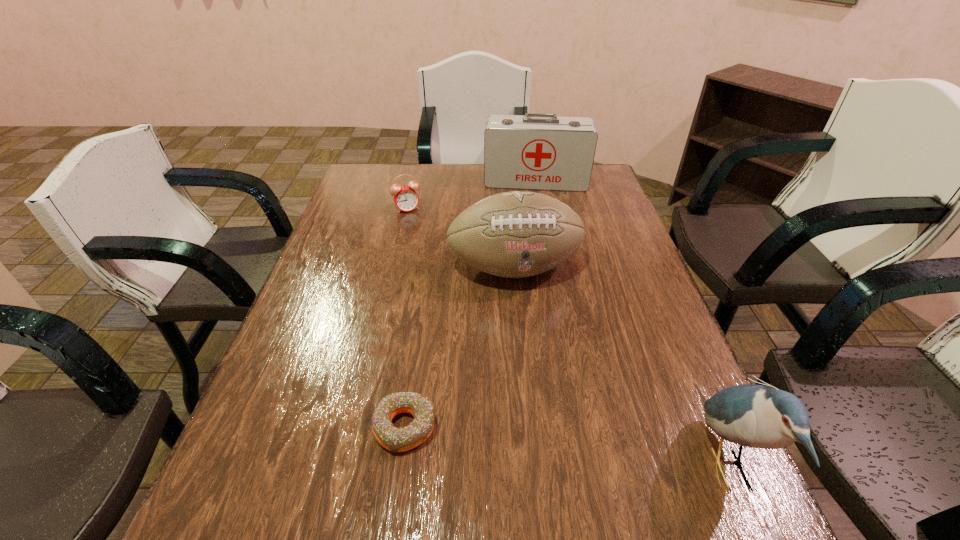
Image resolution: width=960 pixels, height=540 pixels. Find the location of `the first-aid kit that is at the right edge`. the first-aid kit that is at the right edge is located at coordinates (533, 151).

Where is `object that is at the far right corner`? The width and height of the screenshot is (960, 540). object that is at the far right corner is located at coordinates (533, 151).

Find the location of a particular element. object situated at the near right corner is located at coordinates (759, 416).

This screenshot has width=960, height=540. Identify the location of vacant region at the far edge of the desktop. (426, 179).

Find the location of a particular element. The image size is (960, 540). vacant space at the near edge is located at coordinates (423, 445).

Find the location of a particular element. free location at the left edge of the desktop is located at coordinates (296, 309).

The width and height of the screenshot is (960, 540). In the image, there is a desktop. In order to click on vacant area at the right edge in this screenshot , I will do `click(604, 248)`.

Find the location of a particular element. Image resolution: width=960 pixels, height=540 pixels. vacant space at the near left corner is located at coordinates (258, 480).

In the image, there is a desktop. In order to click on vacant region at the far right corner in this screenshot , I will do `click(595, 167)`.

Identify the location of free space between the bird and the football (American). The image size is (960, 540). (621, 367).